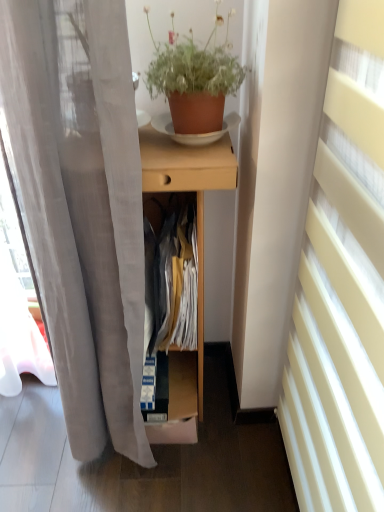
The height and width of the screenshot is (512, 384). Identify the location of vacant space situated above light wood desk at center (from a real-world perspective). (177, 143).